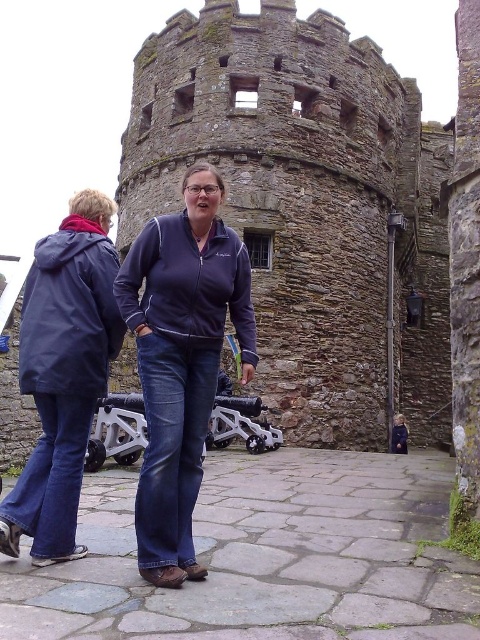
You are standing in front of the historic stone tower and see a person wearing a matte blue jacket at center and dark blue jeans at center. Which piece of clothing is higher on their body?

The matte blue jacket at center is located above dark blue jeans at center, so the jacket is higher on their body.

You are standing on the cobblestone pathway and want to take a photo of the dark brown stone tower at center and the navy blue fleece at center. Which object should you focus on first to ensure both are in focus?

You should focus on the navy blue fleece at center first because it is closer to you than the dark brown stone tower at center, so adjusting focus from near to far will help both be in focus.

You are standing on the cobblestone pathway and want to take a photo of the dark brown stone tower at center without the dark blue jeans at center blocking the view. Which direction should you move to ensure the tower is fully visible?

Move to the left or right so that the dark blue jeans at center are no longer in front of the dark brown stone tower at center. Since the tower might be wider than the jeans, adjusting your position sideways will help frame the tower without obstruction.